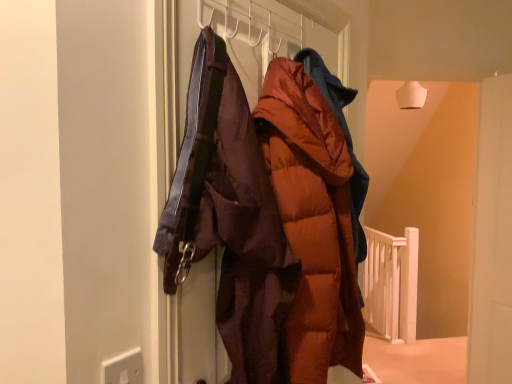
Question: Considering the relative sizes of matte brown puffer jacket at center and white wooden rail at lower right in the image provided, is matte brown puffer jacket at center shorter than white wooden rail at lower right?

Choices:
 (A) yes
 (B) no

Answer: (A)

Question: Does matte brown puffer jacket at center have a greater width compared to white wooden rail at lower right?

Choices:
 (A) no
 (B) yes

Answer: (B)

Question: Is matte brown puffer jacket at center in front of white wooden rail at lower right?

Choices:
 (A) yes
 (B) no

Answer: (A)

Question: From a real-world perspective, is matte brown puffer jacket at center over white wooden rail at lower right?

Choices:
 (A) yes
 (B) no

Answer: (A)

Question: Considering the relative sizes of matte brown puffer jacket at center and white wooden rail at lower right in the image provided, is matte brown puffer jacket at center thinner than white wooden rail at lower right?

Choices:
 (A) yes
 (B) no

Answer: (B)

Question: From the image's perspective, is orange puffy coat at center located above or below white plastic electric outlet at lower left?

Choices:
 (A) below
 (B) above

Answer: (B)

Question: Is orange puffy coat at center inside the boundaries of white plastic electric outlet at lower left, or outside?

Choices:
 (A) inside
 (B) outside

Answer: (B)

Question: In the image, is orange puffy coat at center positioned in front of or behind white plastic electric outlet at lower left?

Choices:
 (A) front
 (B) behind

Answer: (B)

Question: From a real-world perspective, is orange puffy coat at center physically located above or below white plastic electric outlet at lower left?

Choices:
 (A) below
 (B) above

Answer: (B)

Question: In terms of height, does orange puffy coat at center look taller or shorter compared to matte brown puffer jacket at center?

Choices:
 (A) short
 (B) tall

Answer: (B)

Question: Relative to matte brown puffer jacket at center, is orange puffy coat at center in front or behind?

Choices:
 (A) front
 (B) behind

Answer: (A)

Question: From the image's perspective, is orange puffy coat at center located above or below matte brown puffer jacket at center?

Choices:
 (A) above
 (B) below

Answer: (B)

Question: Is orange puffy coat at center wider or thinner than matte brown puffer jacket at center?

Choices:
 (A) wide
 (B) thin

Answer: (A)

Question: Relative to white wooden rail at lower right, is matte brown puffer jacket at center in front or behind?

Choices:
 (A) front
 (B) behind

Answer: (A)

Question: Is matte brown puffer jacket at center wider or thinner than white wooden rail at lower right?

Choices:
 (A) thin
 (B) wide

Answer: (B)